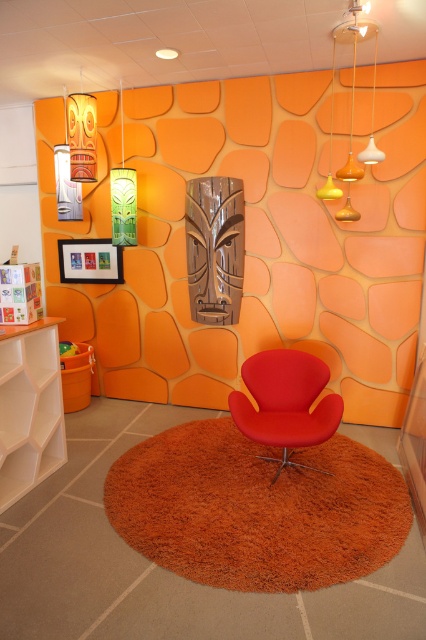
Looking at this image, you are standing in the room and want to hang a new painting between the metallic silver lampshade at upper left and the white glossy pendant light at upper right. Based on their positions, which lamp is closer to the ceiling so you can hang the painting below it?

The white glossy pendant light at upper right is higher up, so hanging the painting below it would place it closer to the metallic silver lampshade at upper left, which is already below the white glossy pendant light at upper right.

Consider the image. You are standing in the room and see two points marked on the wall. The first point is at coordinates point (350, 202) and the second is at point (123, 125). Which point is closer to you?

Point (350, 202) is closer to the viewer than point (123, 125).